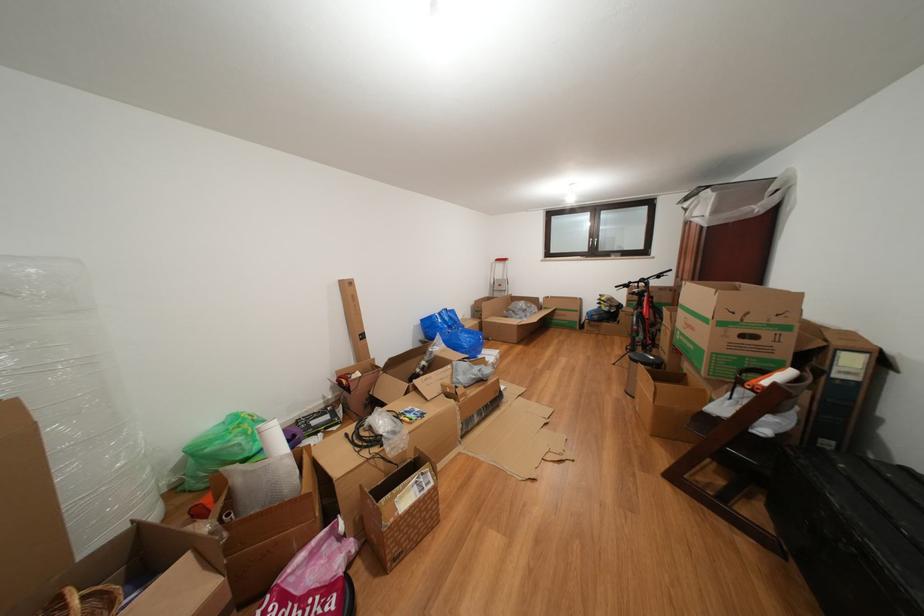
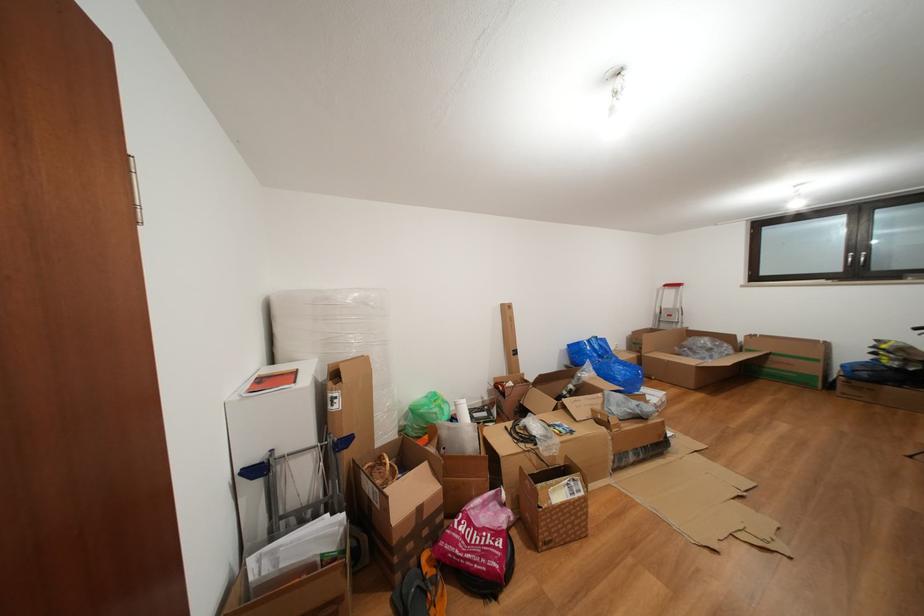
Find the pixel in the second image that matches (505,265) in the first image.

(674, 291)